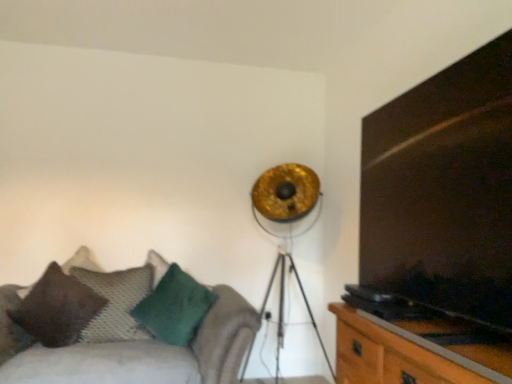
Question: Should I look upward or downward to see green fuzzy pillow at lower left, the 1th pillow from the right?

Choices:
 (A) down
 (B) up

Answer: (A)

Question: Is brown textured pillow at lower left, the first pillow viewed from the left, closer to the viewer compared to velvet green cushion at lower left?

Choices:
 (A) yes
 (B) no

Answer: (B)

Question: From a real-world perspective, does brown textured pillow at lower left, positioned as the third pillow in right-to-left order, stand above velvet green cushion at lower left?

Choices:
 (A) yes
 (B) no

Answer: (A)

Question: Is velvet green cushion at lower left a part of brown textured pillow at lower left, positioned as the third pillow in right-to-left order?

Choices:
 (A) no
 (B) yes

Answer: (A)

Question: Does brown textured pillow at lower left, the first pillow viewed from the left, appear on the right side of velvet green cushion at lower left?

Choices:
 (A) yes
 (B) no

Answer: (B)

Question: Does brown textured pillow at lower left, the first pillow viewed from the left, have a lesser width compared to velvet green cushion at lower left?

Choices:
 (A) no
 (B) yes

Answer: (B)

Question: From a real-world perspective, is brown textured pillow at lower left, positioned as the third pillow in right-to-left order, under velvet green cushion at lower left?

Choices:
 (A) no
 (B) yes

Answer: (A)

Question: Could you tell me if brown textured pillow at lower left, the first pillow viewed from the left, is facing wooden cabinet at right?

Choices:
 (A) yes
 (B) no

Answer: (B)

Question: From a real-world perspective, is brown textured pillow at lower left, the first pillow viewed from the left, beneath wooden cabinet at right?

Choices:
 (A) no
 (B) yes

Answer: (A)

Question: Is brown textured pillow at lower left, positioned as the third pillow in right-to-left order, not near wooden cabinet at right?

Choices:
 (A) yes
 (B) no

Answer: (A)

Question: Does brown textured pillow at lower left, the first pillow viewed from the left, touch wooden cabinet at right?

Choices:
 (A) no
 (B) yes

Answer: (A)

Question: From the image's perspective, is brown textured pillow at lower left, the first pillow viewed from the left, on wooden cabinet at right?

Choices:
 (A) yes
 (B) no

Answer: (A)

Question: Is brown textured pillow at lower left, the first pillow viewed from the left, wider than wooden cabinet at right?

Choices:
 (A) yes
 (B) no

Answer: (A)

Question: From a real-world perspective, is dark wood entertainment center at right located higher than gold metallic tripod lamp at upper center?

Choices:
 (A) yes
 (B) no

Answer: (A)